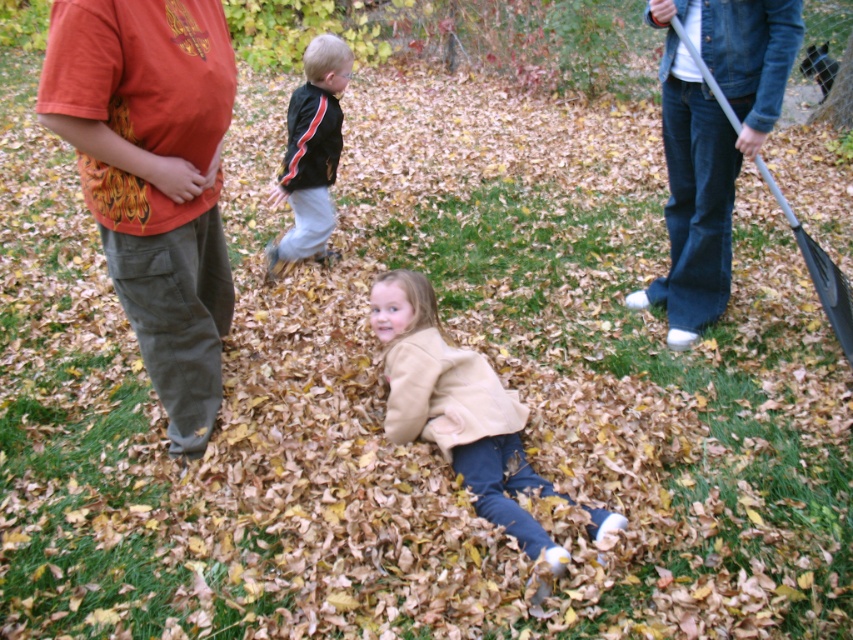
Question: Which point is closer to the camera?

Choices:
 (A) (834, 266)
 (B) (602, 536)
 (C) (112, 26)
 (D) (305, 252)

Answer: (C)

Question: Which of the following is the farthest from the observer?

Choices:
 (A) black matte jacket at center
 (B) metallic gray shovel at right
 (C) orange t-shirt at left

Answer: (A)

Question: Among these points, which one is farthest from the camera?

Choices:
 (A) (427, 337)
 (B) (311, 76)
 (C) (97, 104)
 (D) (827, 285)

Answer: (B)

Question: Observing the image, what is the correct spatial positioning of orange t-shirt at left in reference to beige soft coat at center?

Choices:
 (A) left
 (B) right

Answer: (A)

Question: Does black matte jacket at center appear on the left side of metallic gray shovel at right?

Choices:
 (A) no
 (B) yes

Answer: (B)

Question: Is black matte jacket at center further to camera compared to metallic gray shovel at right?

Choices:
 (A) no
 (B) yes

Answer: (B)